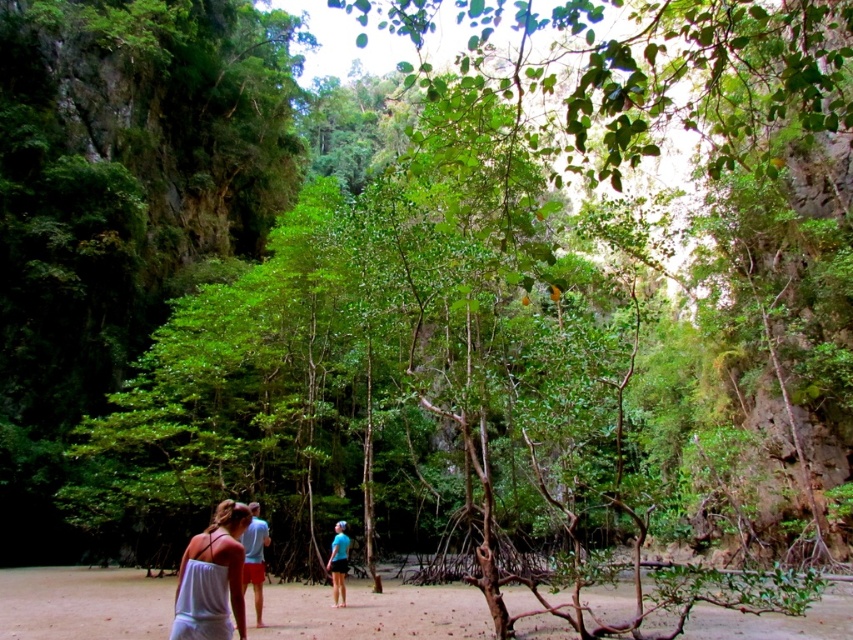
Question: Based on their relative distances, which object is farther from the blue fabric shirt at center?

Choices:
 (A) light blue fabric shorts at center
 (B) white fabric tank top at lower left
 (C) brown sandy dirt at lower center

Answer: (B)

Question: Estimate the real-world distances between objects in this image. Which object is farther from the white fabric tank top at lower left?

Choices:
 (A) light blue fabric shorts at center
 (B) blue fabric shirt at center

Answer: (B)

Question: Which is farther from the white fabric tank top at lower left?

Choices:
 (A) blue fabric shirt at center
 (B) brown sandy dirt at lower center
 (C) light blue fabric shorts at center

Answer: (B)

Question: Is brown sandy dirt at lower center above blue fabric shirt at center?

Choices:
 (A) no
 (B) yes

Answer: (A)

Question: Does brown sandy dirt at lower center appear over light blue fabric shorts at center?

Choices:
 (A) yes
 (B) no

Answer: (B)

Question: Is brown sandy dirt at lower center thinner than blue fabric shirt at center?

Choices:
 (A) yes
 (B) no

Answer: (B)